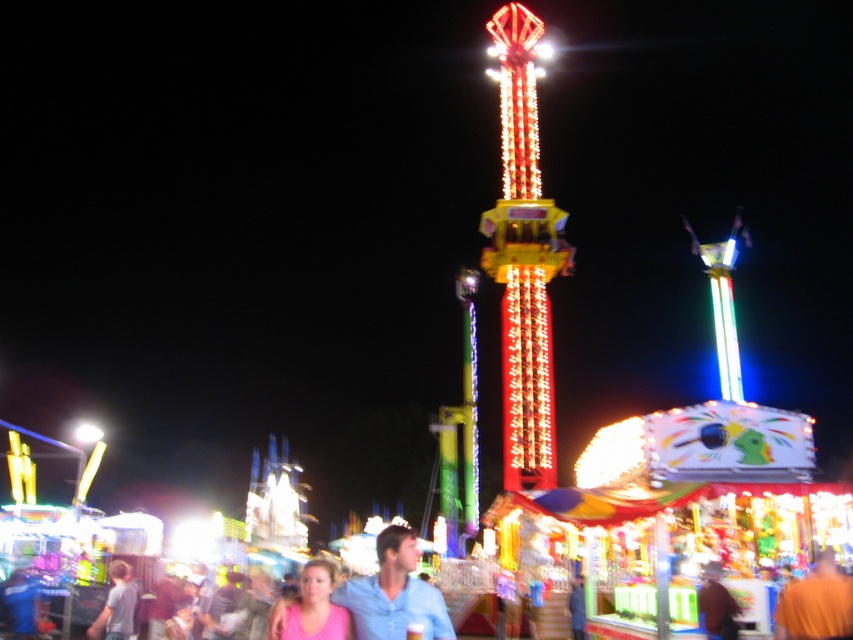
You are at the fairground and see an orange cloth at center and a pink matte shirt at lower center. Which object appears smaller in size?

The orange cloth at center is smaller than the pink matte shirt at lower center.

You are at a fairground and notice two shirts hanging on adjacent racks. The blue cotton shirt at center and the pink matte shirt at lower center. Which shirt has a greater width?

The blue cotton shirt at center has a greater width than the pink matte shirt at lower center.

You are at the fairground and see a blue cotton shirt at center and a light blue shirt at lower left. Which one is taller?

The blue cotton shirt at center is taller than the light blue shirt at lower left.